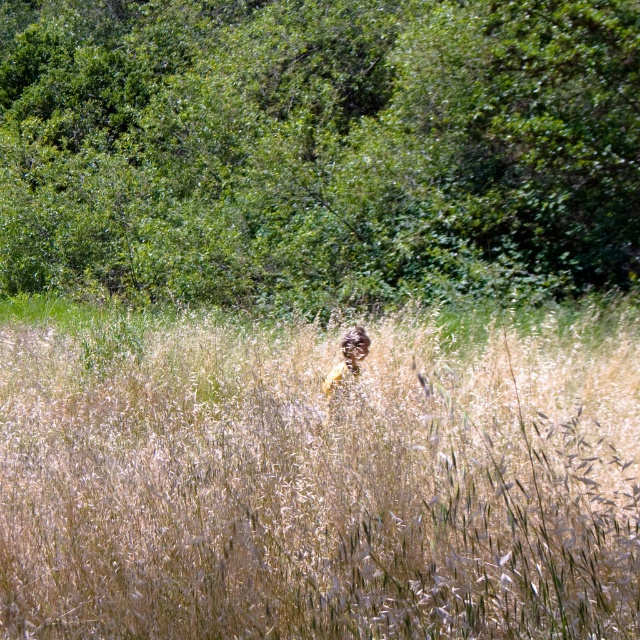
You are standing in a field and see the dry grass at center and the green leafy tree at upper center. Which object is closer to the ground?

The dry grass at center is closer to the ground because it is below the green leafy tree at upper center.

You are standing in the middle of the golden grasses and see the green leafy tree at upper center and the brown textured jacket at center. Which object is taller?

The green leafy tree at upper center is much taller than the brown textured jacket at center.

You are standing at the center of the scene and want to walk towards the dense cluster of green foliage in the background. Which direction should you move relative to the dry grass at center?

The dry grass at center is located at point (317, 474). To reach the dense cluster of green foliage in the background, you should move away from the dry grass at center towards the background area where the foliage is situated.